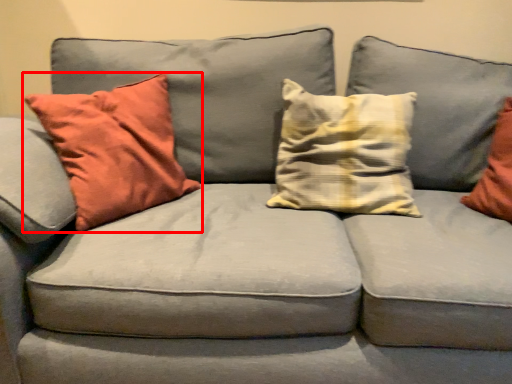
Question: From the image's perspective, what is the correct spatial positioning of pillow (annotated by the red box) in reference to pillow?

Choices:
 (A) below
 (B) above

Answer: (A)